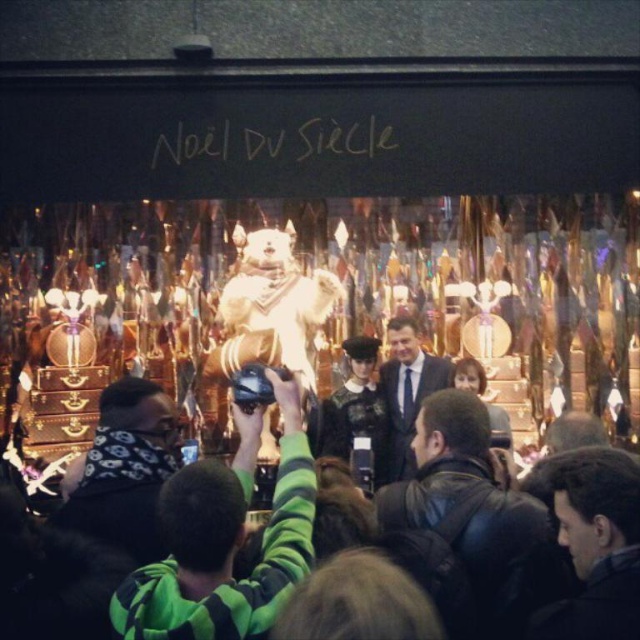
Question: Can you confirm if leather jacket at center is positioned to the right of matte black suit at center?

Choices:
 (A) no
 (B) yes

Answer: (B)

Question: Considering the relative positions of dark brown leather jacket at center and matte black suit at center in the image provided, where is dark brown leather jacket at center located with respect to matte black suit at center?

Choices:
 (A) right
 (B) left

Answer: (A)

Question: Which is nearer to the leather jacket at center?

Choices:
 (A) white fur bear at center
 (B) white plush bear at center
 (C) dark brown leather jacket at lower left
 (D) matte black suit at center

Answer: (D)

Question: Which of the following is the farthest from the observer?

Choices:
 (A) (298, 305)
 (B) (404, 451)
 (C) (628, 458)

Answer: (A)

Question: Among these objects, which one is nearest to the camera?

Choices:
 (A) leather jacket at center
 (B) green and black striped sweater at center
 (C) white fur bear at center

Answer: (B)

Question: Is dark brown leather jacket at lower left further to the viewer compared to white fur bear at center?

Choices:
 (A) no
 (B) yes

Answer: (A)